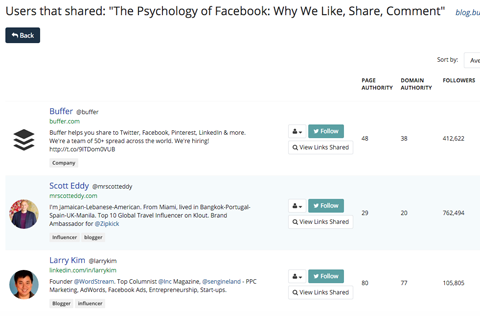
I want to click on icon, stack of books, so click(26, 141).